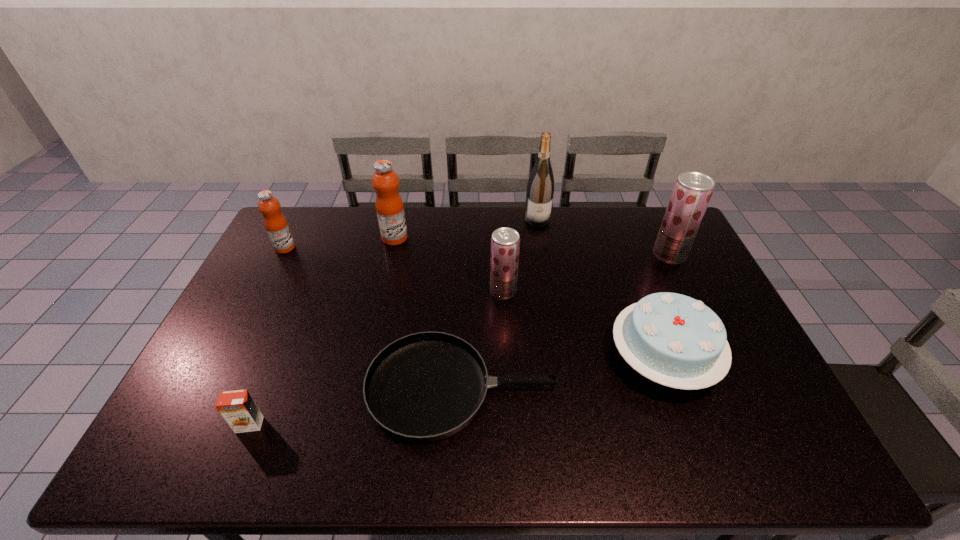
Image resolution: width=960 pixels, height=540 pixels. In order to click on free region located on the front label of the leftmost object in this screenshot , I will do `click(354, 248)`.

Where is `vacant area located on the right of the sixth tallest object`? This screenshot has height=540, width=960. vacant area located on the right of the sixth tallest object is located at coordinates (738, 359).

The height and width of the screenshot is (540, 960). I want to click on free space located 0.080m on the back of the second object from left to right, so click(264, 389).

You are a GUI agent. You are given a task and a screenshot of the screen. Output one action in this format:
    pyautogui.click(x=<x>, y=<y>)
    Task: Click on the vacant region located 0.300m on the handle side of the frying pan
    The image size is (960, 540).
    Given the screenshot: What is the action you would take?
    pyautogui.click(x=673, y=388)

The height and width of the screenshot is (540, 960). What are the coordinates of `wine bottle that is positioned at the far edge` in the screenshot? It's located at (540, 189).

In order to click on orange juice located in the near edge section of the desktop in this screenshot , I will do `click(239, 410)`.

Locate an element on the screen. The height and width of the screenshot is (540, 960). frying pan positioned at the near edge is located at coordinates (424, 387).

The height and width of the screenshot is (540, 960). I want to click on object located at the left edge, so click(x=276, y=225).

This screenshot has width=960, height=540. I want to click on fruit juice at the right edge, so click(x=692, y=191).

Where is `birthday cake at the right edge`? The height and width of the screenshot is (540, 960). birthday cake at the right edge is located at coordinates (672, 339).